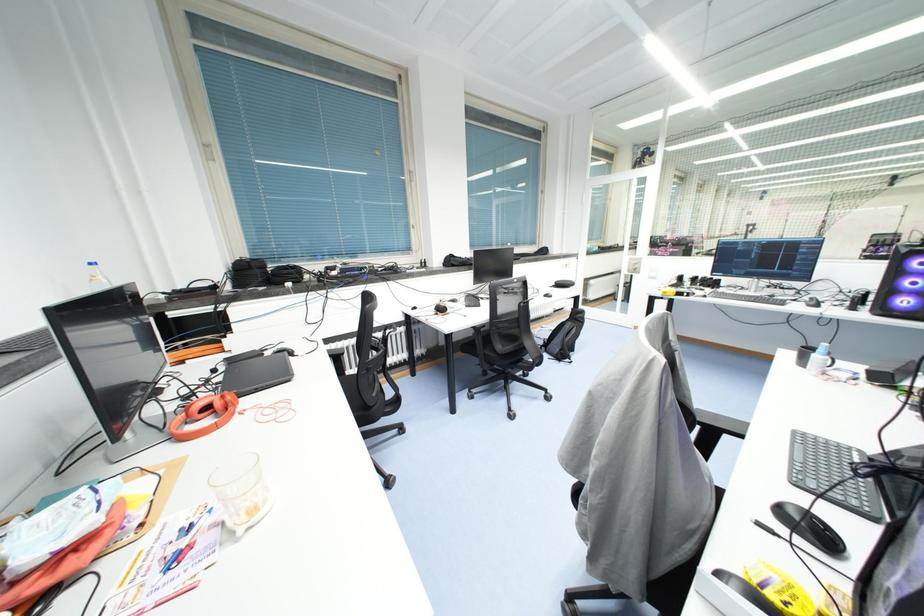
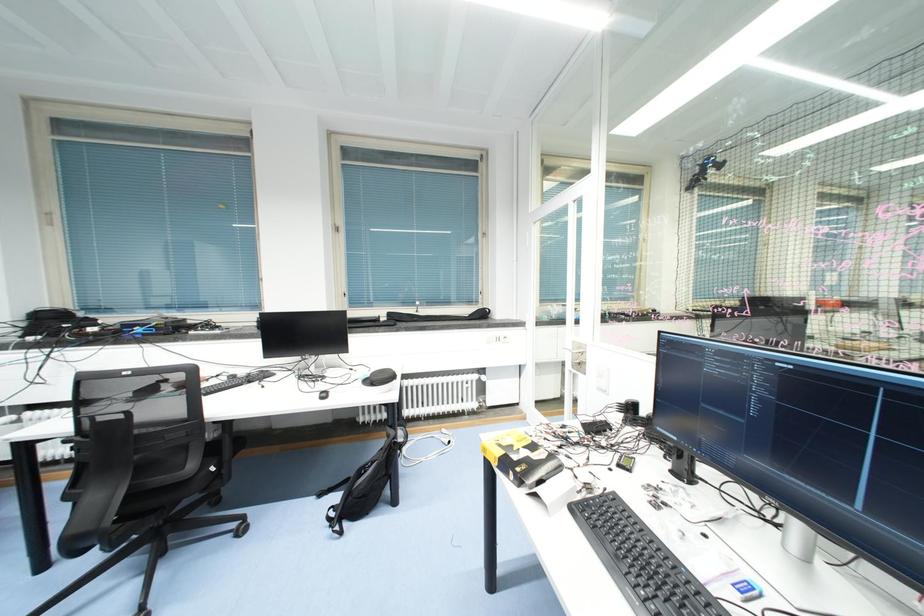
From the picture: In a continuous first-person perspective shot, in which direction is the camera moving?

The movement direction of the cameraman is right, forward.